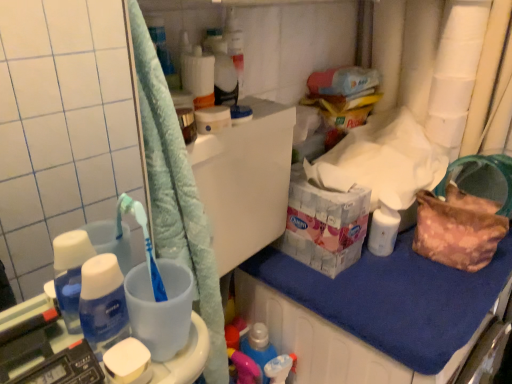
The image size is (512, 384). What are the coordinates of `vacant area that lies to the right of white glossy bottle at right` in the screenshot? It's located at (x=435, y=259).